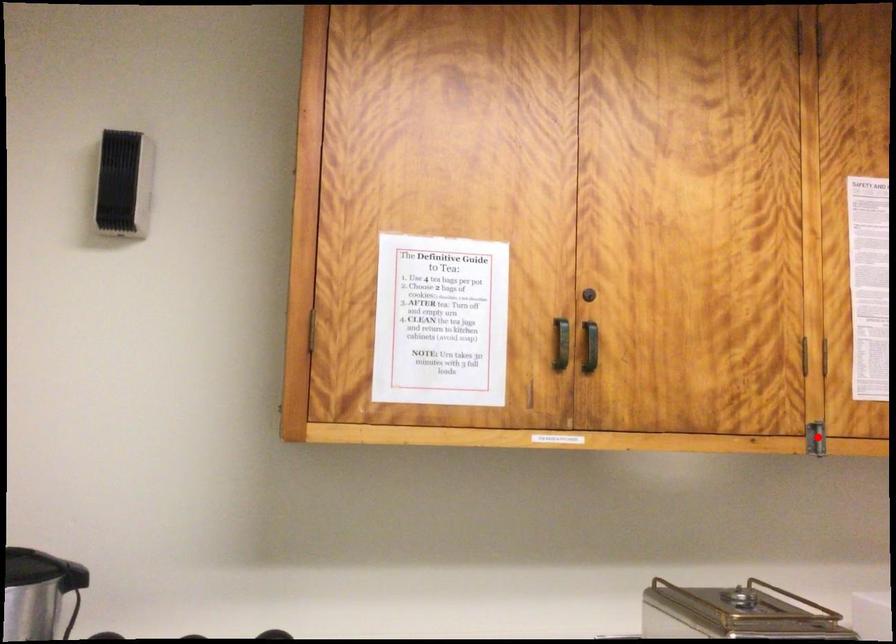
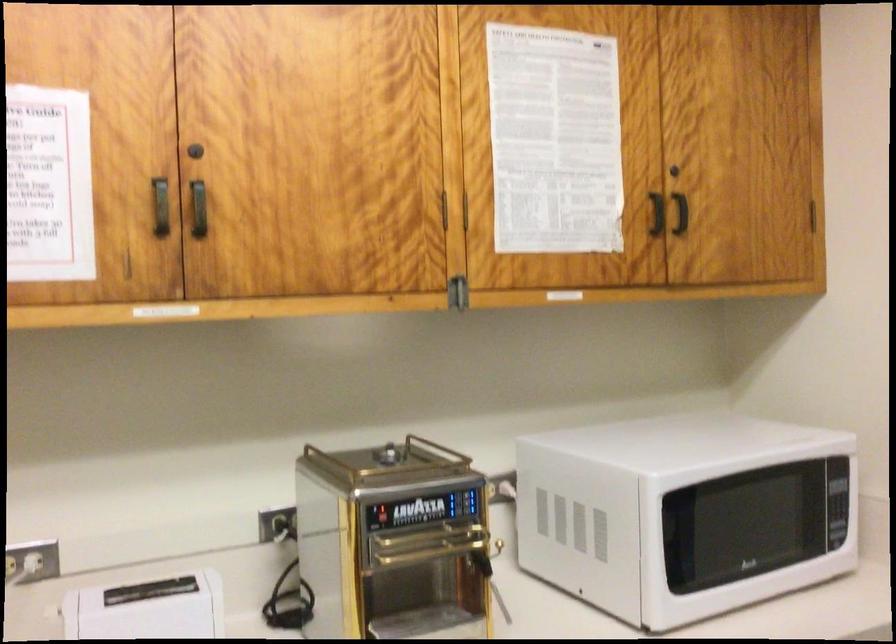
Locate, in the second image, the point that corresponds to the highlighted location in the first image.

(458, 292)